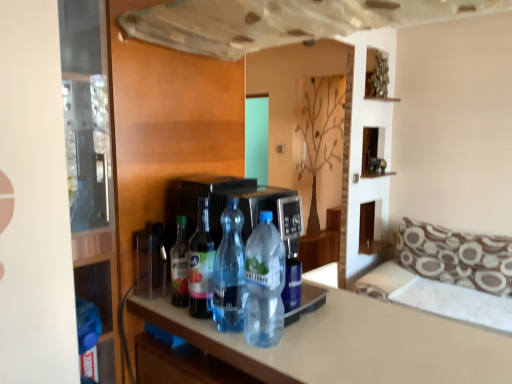
Question: From the image's perspective, is brown patterned fabric couch at right above translucent plastic bottle at center, the first bottle positioned from the left?

Choices:
 (A) no
 (B) yes

Answer: (A)

Question: From a real-world perspective, is brown patterned fabric couch at right on translucent plastic bottle at center, the first bottle positioned from the left?

Choices:
 (A) no
 (B) yes

Answer: (A)

Question: Does brown patterned fabric couch at right appear on the right side of translucent plastic bottle at center, the first bottle positioned from the left?

Choices:
 (A) no
 (B) yes

Answer: (B)

Question: Is brown patterned fabric couch at right far from translucent plastic bottle at center, the fourth bottle in the right-to-left sequence?

Choices:
 (A) no
 (B) yes

Answer: (B)

Question: Can translucent plastic bottle at center, the first bottle positioned from the left, be found inside brown patterned fabric couch at right?

Choices:
 (A) no
 (B) yes

Answer: (A)

Question: From the image's perspective, is clear plastic bottle at center, which ranks as the 1th bottle in right-to-left order, above or below brown printed fabric pillow at right?

Choices:
 (A) below
 (B) above

Answer: (B)

Question: Considering their positions, is clear plastic bottle at center, acting as the fourth bottle starting from the left, located in front of or behind brown printed fabric pillow at right?

Choices:
 (A) behind
 (B) front

Answer: (B)

Question: In terms of width, does clear plastic bottle at center, which ranks as the 1th bottle in right-to-left order, look wider or thinner when compared to brown printed fabric pillow at right?

Choices:
 (A) thin
 (B) wide

Answer: (A)

Question: Based on their sizes in the image, would you say clear plastic bottle at center, which ranks as the 1th bottle in right-to-left order, is bigger or smaller than brown printed fabric pillow at right?

Choices:
 (A) small
 (B) big

Answer: (A)

Question: Is metallic silver sculpture at upper center spatially inside transparent glass door at left, or outside of it?

Choices:
 (A) inside
 (B) outside

Answer: (B)

Question: From the image's perspective, is metallic silver sculpture at upper center positioned above or below transparent glass door at left?

Choices:
 (A) below
 (B) above

Answer: (B)

Question: Looking at their shapes, would you say metallic silver sculpture at upper center is wider or thinner than transparent glass door at left?

Choices:
 (A) thin
 (B) wide

Answer: (A)

Question: Considering their positions, is metallic silver sculpture at upper center located in front of or behind transparent glass door at left?

Choices:
 (A) front
 (B) behind

Answer: (B)

Question: Would you say translucent plastic bottle at center, the first bottle positioned from the left, is to the left or to the right of transparent plastic bottle at center, which is the 2th bottle in right-to-left order, in the picture?

Choices:
 (A) right
 (B) left

Answer: (B)

Question: In terms of height, does translucent plastic bottle at center, the first bottle positioned from the left, look taller or shorter compared to transparent plastic bottle at center, which is the 2th bottle in right-to-left order?

Choices:
 (A) short
 (B) tall

Answer: (A)